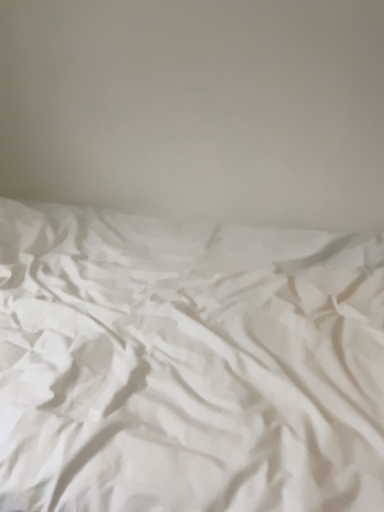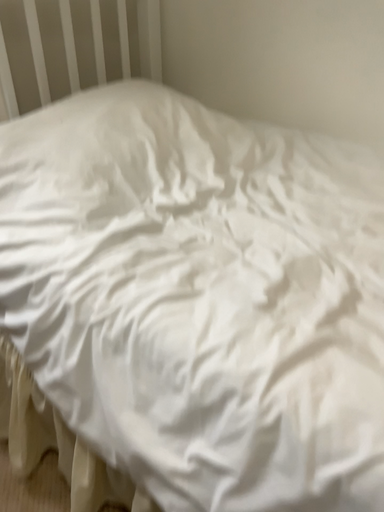
Question: How did the camera likely rotate when shooting the video?

Choices:
 (A) rotated downward
 (B) rotated upward

Answer: (A)